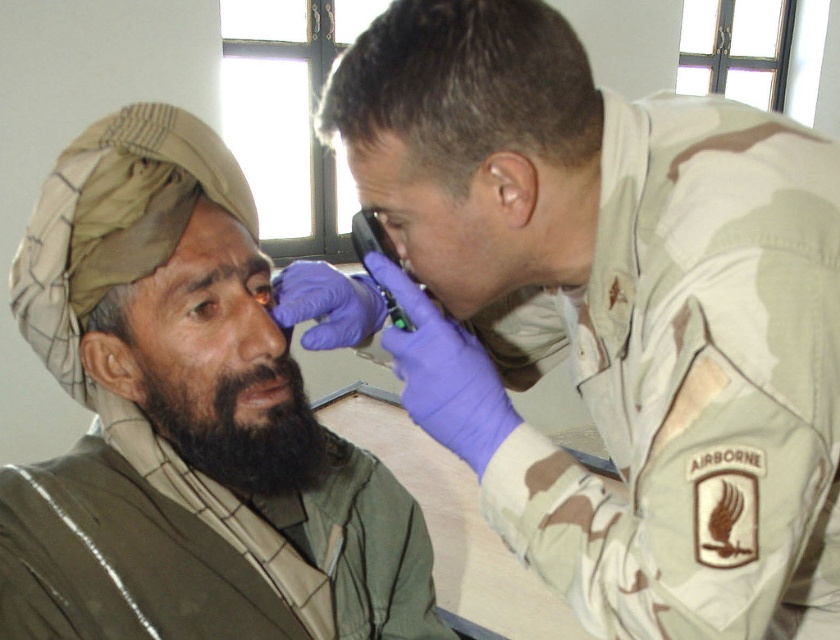
You are a photographer setting up for a group photo. You notice the bearded man at left and the brown matte nose at center in the frame. Which object should you adjust to ensure both are visible in the photo?

The bearded man at left is positioned under the brown matte nose at center, so you should adjust the brown matte nose at center to move it out of the way so the bearded man at left can be seen.

Consider the image. You are a photographer trying to capture a closeup shot of the bearded man at left and the black fuzzy beard at lower left. Since you want both subjects to appear equally prominent in the photo, which one should you zoom in on more?

The bearded man at left is larger in size than the black fuzzy beard at lower left, so you should zoom in more on the black fuzzy beard at lower left to make them appear equally prominent.